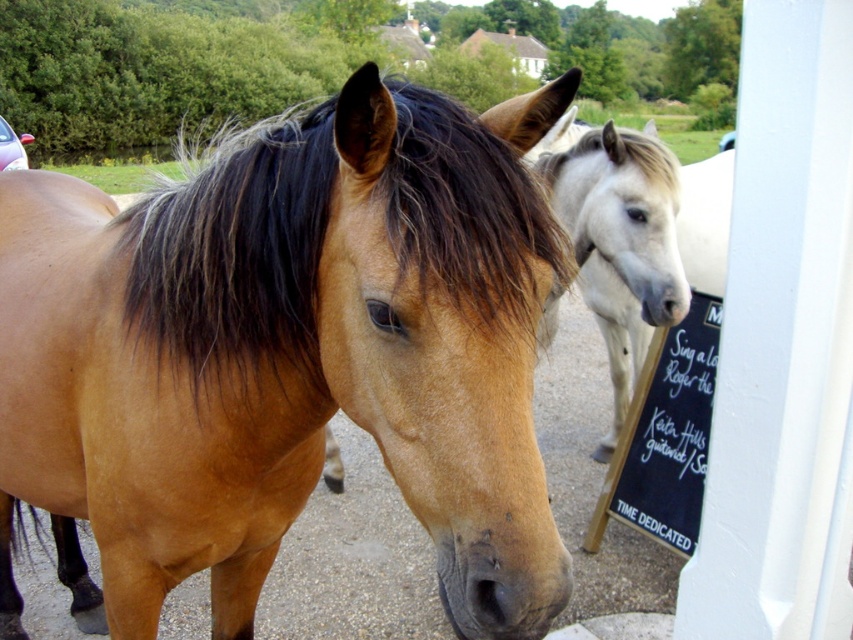
Question: Among these objects, which one is nearest to the camera?

Choices:
 (A) black chalkboard at right
 (B) brown glossy horse at center

Answer: (B)

Question: Which object is farther from the camera taking this photo?

Choices:
 (A) brown silky mane at center
 (B) black chalkboard at right

Answer: (B)

Question: Is brown silky mane at center behind white glossy horse at center?

Choices:
 (A) yes
 (B) no

Answer: (B)

Question: Is brown glossy horse at center bigger than white glossy horse at center?

Choices:
 (A) no
 (B) yes

Answer: (B)

Question: Which is farther from the white glossy horse at center?

Choices:
 (A) brown silky mane at center
 (B) black chalkboard at right

Answer: (A)

Question: Does brown silky mane at center appear under white glossy horse at center?

Choices:
 (A) no
 (B) yes

Answer: (A)